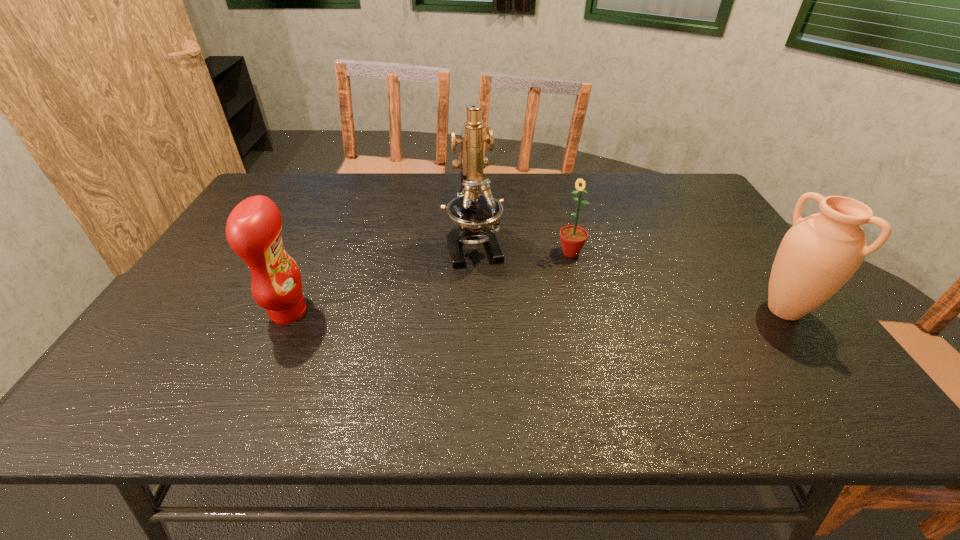
The width and height of the screenshot is (960, 540). Identify the location of vacant region between the tallest object and the urn. (629, 277).

At what (x,y) coordinates should I click in order to perform the action: click on free spot between the condiment and the microscope. Please return your answer as a coordinate pair (x, y). Looking at the image, I should click on tap(381, 278).

Find the location of a particular element. vacant area that lies between the tallest object and the third object from left to right is located at coordinates (522, 248).

Where is `vacant space that is in between the microscope and the leftmost object`? vacant space that is in between the microscope and the leftmost object is located at coordinates (381, 278).

This screenshot has width=960, height=540. In order to click on free space between the leftmost object and the third object from right to left in this screenshot , I will do (x=381, y=278).

You are a GUI agent. You are given a task and a screenshot of the screen. Output one action in this format:
    pyautogui.click(x=<x>, y=<y>)
    Task: Click on the free point between the tallest object and the condiment
    The image size is (960, 540).
    Given the screenshot: What is the action you would take?
    pyautogui.click(x=381, y=278)

The image size is (960, 540). Find the location of `empty space that is in between the microscope and the urn`. empty space that is in between the microscope and the urn is located at coordinates (629, 277).

Where is `vacant area that lies between the condiment and the microscope`? vacant area that lies between the condiment and the microscope is located at coordinates (381, 278).

Locate an element on the screen. This screenshot has height=540, width=960. the closest object to the tallest object is located at coordinates (573, 238).

The width and height of the screenshot is (960, 540). Identify the location of the second closest object relative to the condiment. (573, 238).